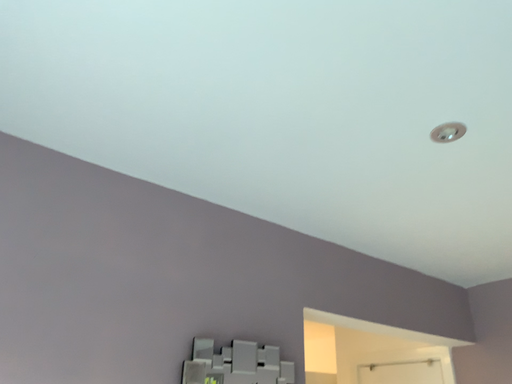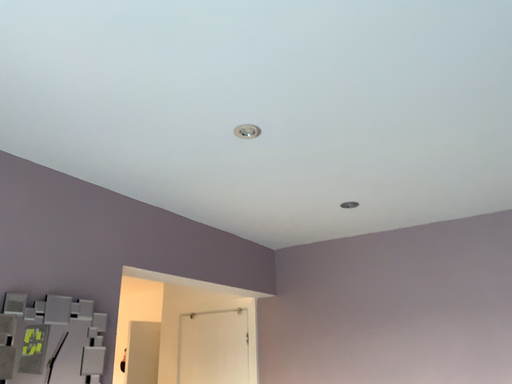
Question: Which way did the camera rotate in the video?

Choices:
 (A) rotated left
 (B) rotated right

Answer: (B)